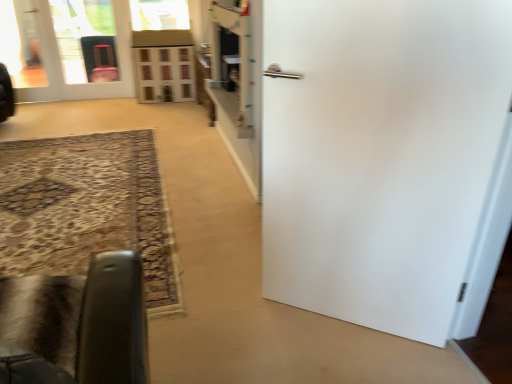
Question: Is wooden dollhouse at center in front of or behind velvet black chair at lower left in the image?

Choices:
 (A) behind
 (B) front

Answer: (A)

Question: In terms of width, does wooden dollhouse at center look wider or thinner when compared to velvet black chair at lower left?

Choices:
 (A) thin
 (B) wide

Answer: (A)

Question: Which is nearer to the wooden dollhouse at center?

Choices:
 (A) matte white door at upper left, which ranks as the 1th door in left-to-right order
 (B) transparent glass door at upper left
 (C) white matte door at right, placed as the first door when sorted from right to left
 (D) velvet black chair at lower left

Answer: (A)

Question: Which of these objects is positioned closest to the velvet black chair at lower left?

Choices:
 (A) transparent glass door at upper left
 (B) matte white door at upper left, which ranks as the 1th door in left-to-right order
 (C) white matte door at right, placed as the 2th door when sorted from top to bottom
 (D) wooden dollhouse at center

Answer: (C)